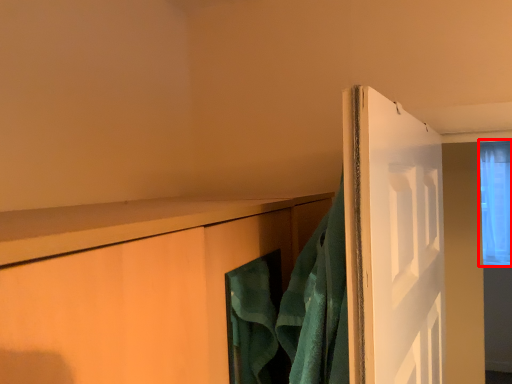
Question: Considering the relative positions of window (annotated by the red box) and bath towel in the image provided, where is window (annotated by the red box) located with respect to the staircase?

Choices:
 (A) right
 (B) left

Answer: (A)